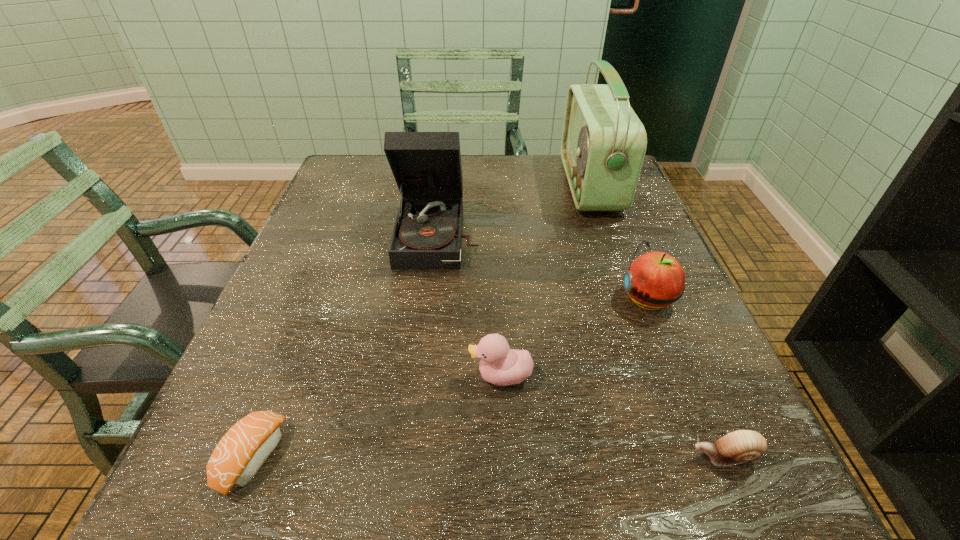
This screenshot has width=960, height=540. Find the location of `vacant region between the tallest object and the shortest object`. vacant region between the tallest object and the shortest object is located at coordinates (420, 321).

At what (x,y) coordinates should I click in order to perform the action: click on free spot between the third nearest object and the escargot. Please return your answer as a coordinate pair (x, y). This screenshot has width=960, height=540. Looking at the image, I should click on (612, 416).

Locate an element on the screen. The height and width of the screenshot is (540, 960). free space between the third tallest object and the leftmost object is located at coordinates (450, 377).

The image size is (960, 540). In order to click on vacant space that is in between the tallest object and the phonograph_record in this screenshot , I will do `click(515, 210)`.

Locate an element on the screen. vacant space that is in between the escargot and the tallest object is located at coordinates (657, 320).

The image size is (960, 540). I want to click on blank region between the fourth shortest object and the tallest object, so click(x=618, y=241).

Image resolution: width=960 pixels, height=540 pixels. Identify the location of free space that is in between the fifth shortest object and the fifth tallest object. (581, 346).

Select which object appears as the fifth closest to the tallest object. Please provide its 2D coordinates. Your answer should be formatted as a tuple, i.e. [(x, y)], where the tuple contains the x and y coordinates of a point satisfying the conditions above.

[(242, 451)]

Choose which object is the third nearest neighbor to the sushi. Please provide its 2D coordinates. Your answer should be formatted as a tuple, i.e. [(x, y)], where the tuple contains the x and y coordinates of a point satisfying the conditions above.

[(739, 446)]

Image resolution: width=960 pixels, height=540 pixels. Identify the location of vacant space that satisfies the following two spatial constraints: 1. on the front panel of the third tallest object; 2. on the left side of the tallest object. (630, 298).